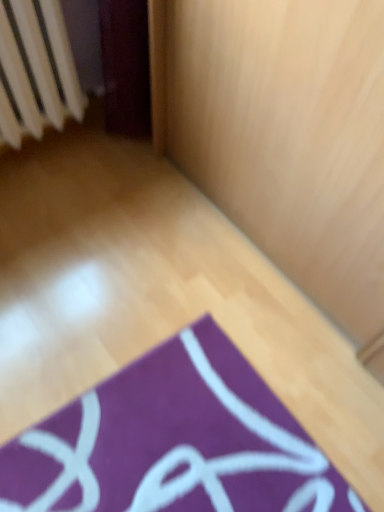
Locate an element on the screen. This screenshot has width=384, height=512. vacant region under white plastic radiator at upper left (from a real-world perspective) is located at coordinates (61, 146).